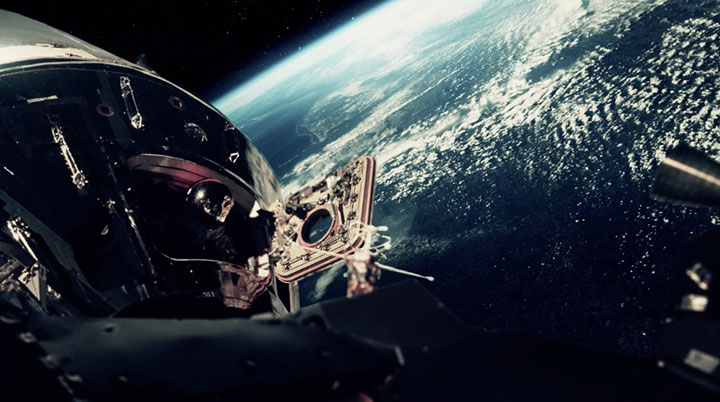
I want to click on glass of the door, so click(x=318, y=229).